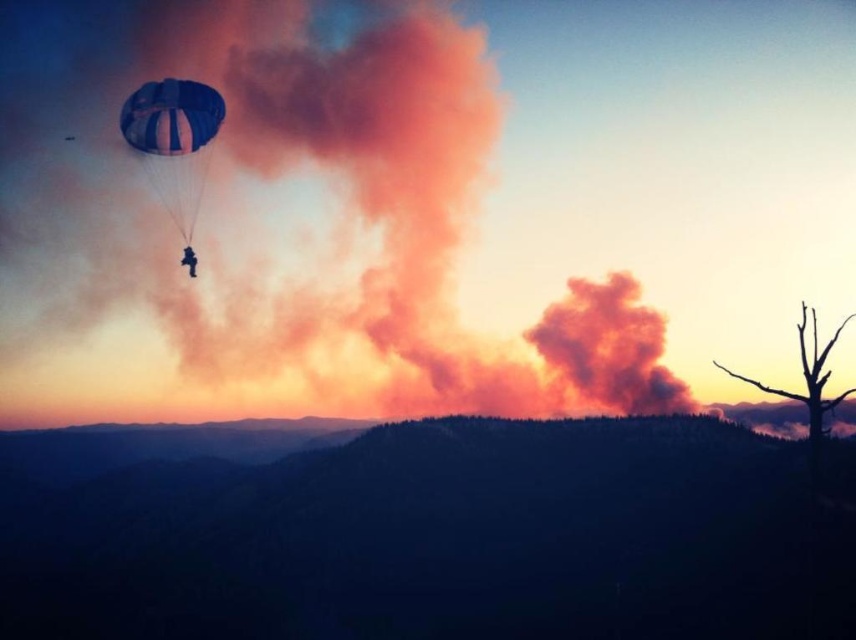
Is green textured hillside at center thinner than blue striped parachute at upper left?

Incorrect, green textured hillside at center's width is not less than blue striped parachute at upper left's.

Is green textured hillside at center taller than blue striped parachute at upper left?

Incorrect, green textured hillside at center's height is not larger of blue striped parachute at upper left's.

Measure the distance between point (230, 536) and camera.

The distance of point (230, 536) from camera is 413.96 meters.

Find the location of a particular element. green textured hillside at center is located at coordinates (441, 540).

Is blue striped parachute at upper left taller than blue fabric parachute at upper left?

Yes, blue striped parachute at upper left is taller than blue fabric parachute at upper left.

Is blue striped parachute at upper left wider than blue fabric parachute at upper left?

Yes.

Does point (194, 276) come farther from viewer compared to point (146, 90)?

No, it is not.

At what (x,y) coordinates should I click in order to perform the action: click on blue striped parachute at upper left. Please return your answer as a coordinate pair (x, y). The width and height of the screenshot is (856, 640). Looking at the image, I should click on (174, 144).

Is green textured hillside at center taller than blue fabric parachute at upper left?

Indeed, green textured hillside at center has a greater height compared to blue fabric parachute at upper left.

The width and height of the screenshot is (856, 640). What do you see at coordinates (441, 540) in the screenshot?
I see `green textured hillside at center` at bounding box center [441, 540].

At what (x,y) coordinates should I click in order to perform the action: click on green textured hillside at center. Please return your answer as a coordinate pair (x, y). The height and width of the screenshot is (640, 856). Looking at the image, I should click on (441, 540).